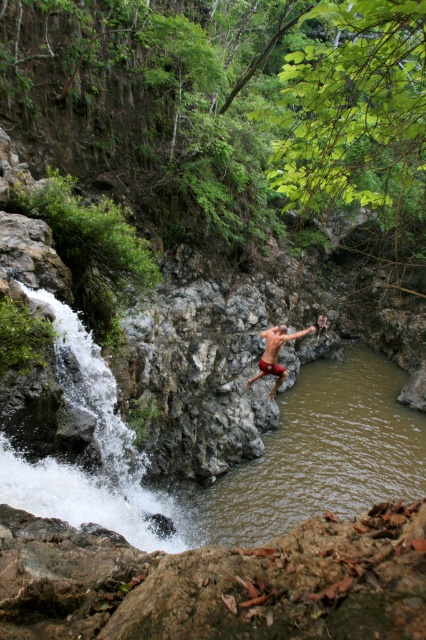
Which of these two, brown rock stream at center or matte red shorts at center, stands shorter?

Standing shorter between the two is matte red shorts at center.

Measure the distance from brown rock stream at center to matte red shorts at center.

brown rock stream at center and matte red shorts at center are 3.71 meters apart from each other.

The height and width of the screenshot is (640, 426). In order to click on brown rock stream at center in this screenshot , I will do `click(316, 456)`.

Identify the location of brown rock stream at center. The width and height of the screenshot is (426, 640). (316, 456).